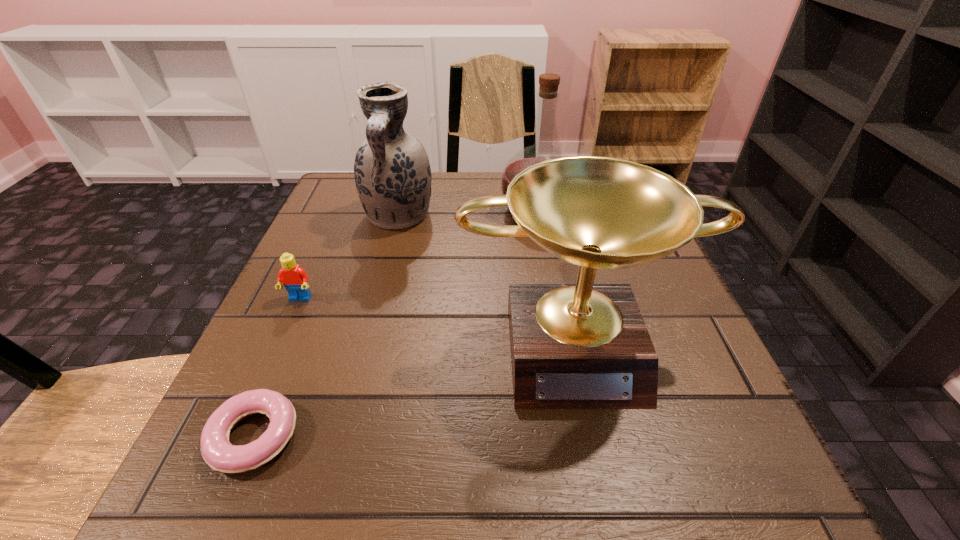
Image resolution: width=960 pixels, height=540 pixels. I want to click on liquor, so click(x=548, y=94).

In order to click on vase in this screenshot , I will do `click(392, 172)`.

The width and height of the screenshot is (960, 540). I want to click on award, so click(573, 346).

Find the location of a particular element. Lego is located at coordinates (295, 280).

At what (x,y) coordinates should I click in order to perform the action: click on the shortest object. Please return your answer as a coordinate pair (x, y). The image size is (960, 540). Looking at the image, I should click on (217, 451).

Locate an element on the screen. free spot located on the front label of the liquor is located at coordinates (564, 360).

You are a GUI agent. You are given a task and a screenshot of the screen. Output one action in this format:
    pyautogui.click(x=<x>, y=<y>)
    Task: Click on the free space located with the handle on the side of the vase
    The image size is (960, 540).
    Given the screenshot: What is the action you would take?
    pyautogui.click(x=351, y=404)

Find the location of a particular element. Image resolution: width=960 pixels, height=540 pixels. free location located 0.050m on the front-facing side of the award is located at coordinates (595, 442).

The width and height of the screenshot is (960, 540). I want to click on free location located 0.330m on the face of the Lego, so click(x=213, y=495).

This screenshot has width=960, height=540. What are the coordinates of `free space located 0.050m on the back of the doughnut` in the screenshot? It's located at (281, 371).